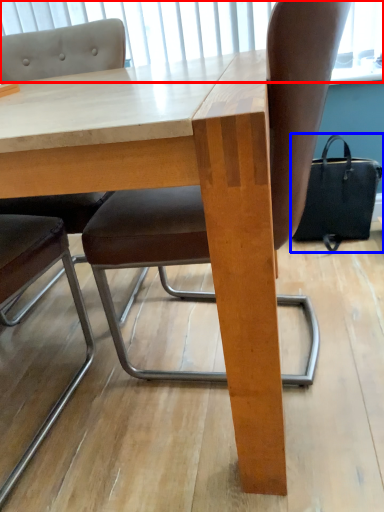
Question: Which point is further to the camera, window screen (highlighted by a red box) or handbag (highlighted by a blue box)?

Choices:
 (A) window screen
 (B) handbag

Answer: (B)